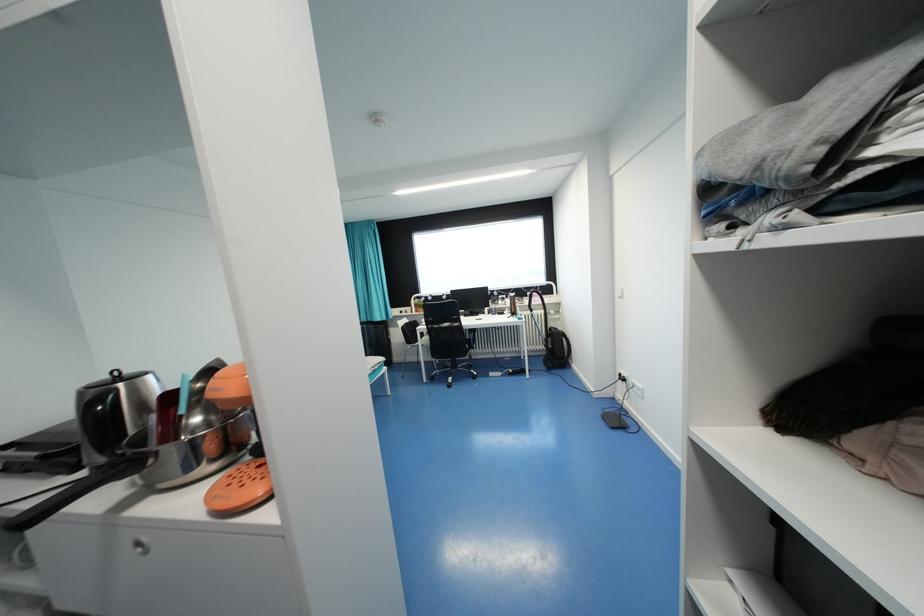
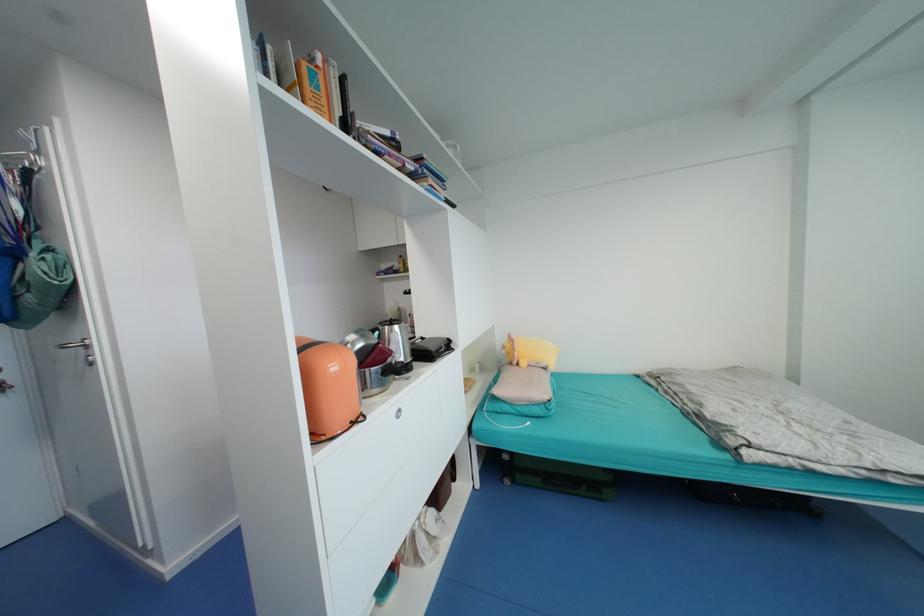
Question: I am providing you with two images of the same scene from different viewpoints. After the viewpoint changes to image2, which objects are now occluded?

Choices:
 (A) stainless steel bowl
 (B) yellow plush pillow
 (C) green chair's surface
 (D) orange cover book

Answer: (A)